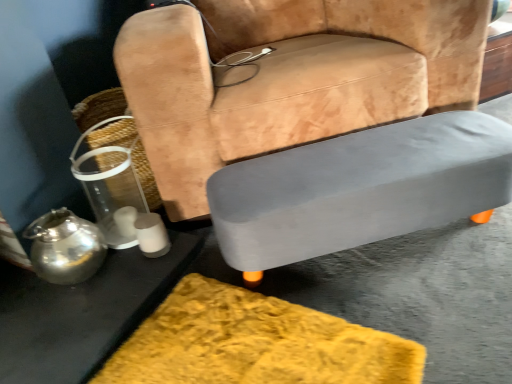
You are a GUI agent. You are given a task and a screenshot of the screen. Output one action in this format:
    pyautogui.click(x=<x>, y=<y>)
    Task: Click on the vacant point to the right of shiny metallic teapot at lower left
    The height and width of the screenshot is (384, 512).
    Given the screenshot: What is the action you would take?
    pyautogui.click(x=129, y=277)